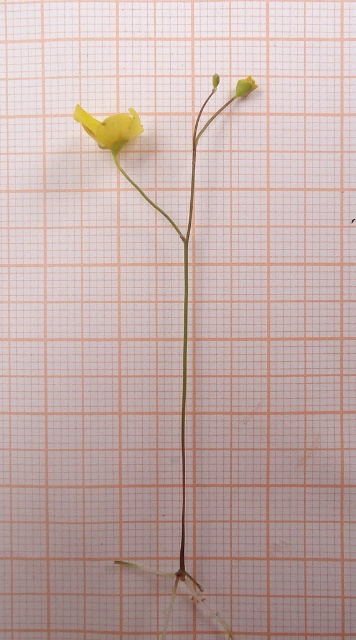
You are a botanist examining the plant specimen against the graph paper. You notice two points marked on the stem at coordinates point (92, 122) and point (253, 83). Which point is closer to the camera?

Point (92, 122) is closer to the camera than point (253, 83).